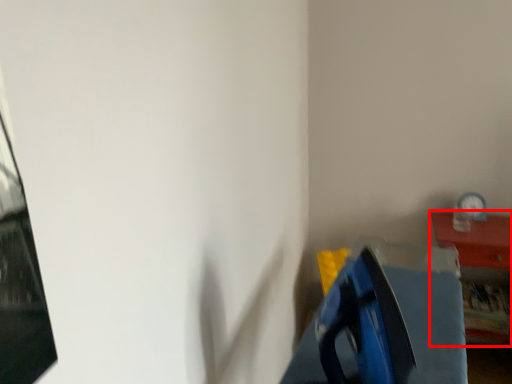
Question: From the image, what is the correct spatial relationship of furniture (annotated by the red box) in relation to clock?

Choices:
 (A) left
 (B) right

Answer: (B)